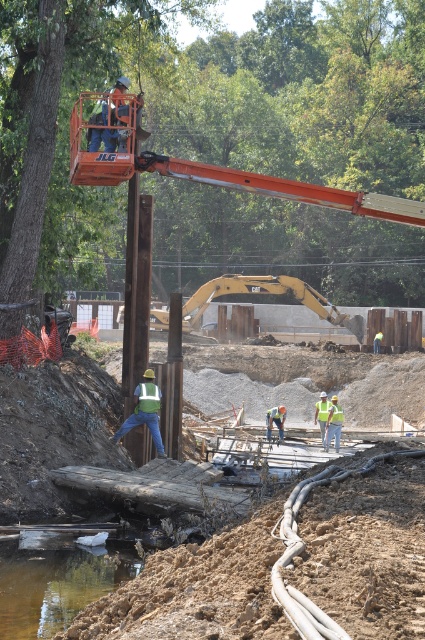
You are a construction worker standing at the point labeled point [150,406] and need to reach the point labeled point [319,419]. Which direction should you move to get there?

You should move backward to reach point [319,419] because point [150,406] is in front of it.

From the picture: You are a construction worker needing to cross the brown wooden plank at center. The point marked at coordinates (x=365, y=545) is where you need to step. Is this point located on the brown wooden plank at center?

Yes, the point marked at coordinates (x=365, y=545) is located on the brown wooden plank at center as stated in the objects description.